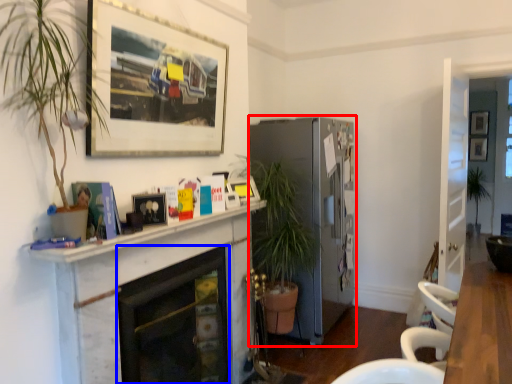
Question: Which point is further to the camera, fireplace (highlighted by a red box) or fireplace (highlighted by a blue box)?

Choices:
 (A) fireplace
 (B) fireplace

Answer: (A)